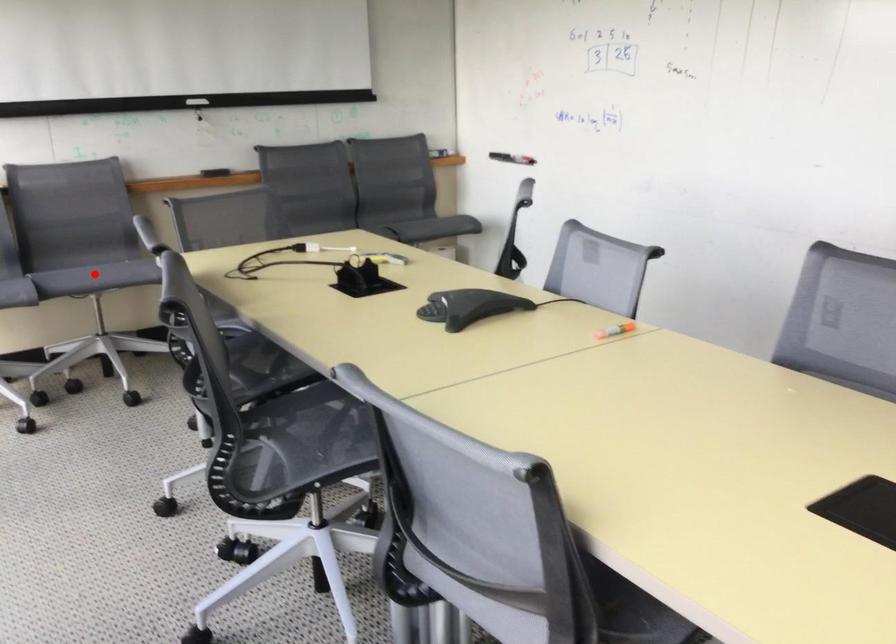
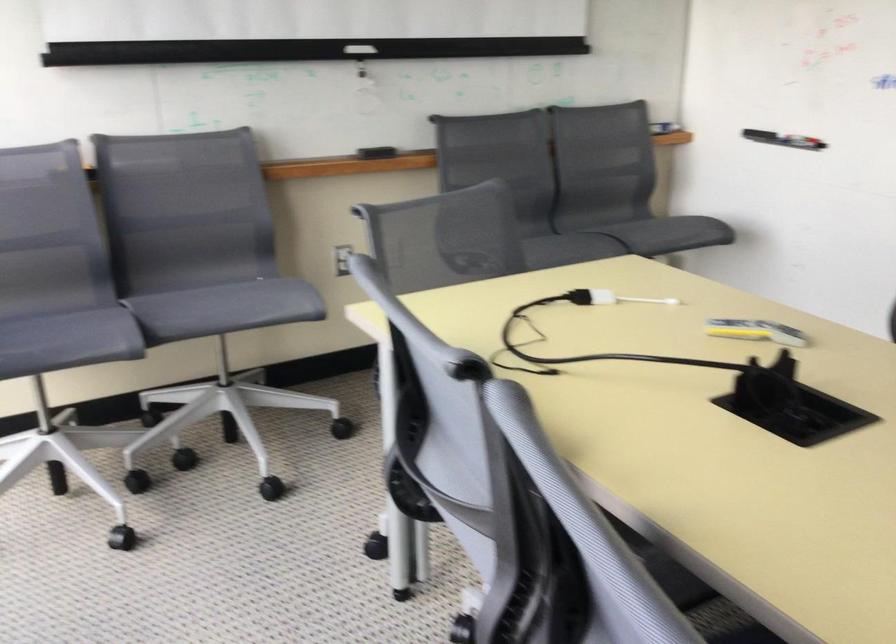
Question: A red point is marked in image1. In image2, is the corresponding 3D point closer to the camera or farther? Reply with the corresponding letter.

Choices:
 (A) The corresponding 3D point is closer.
 (B) The corresponding 3D point is farther.

Answer: (A)